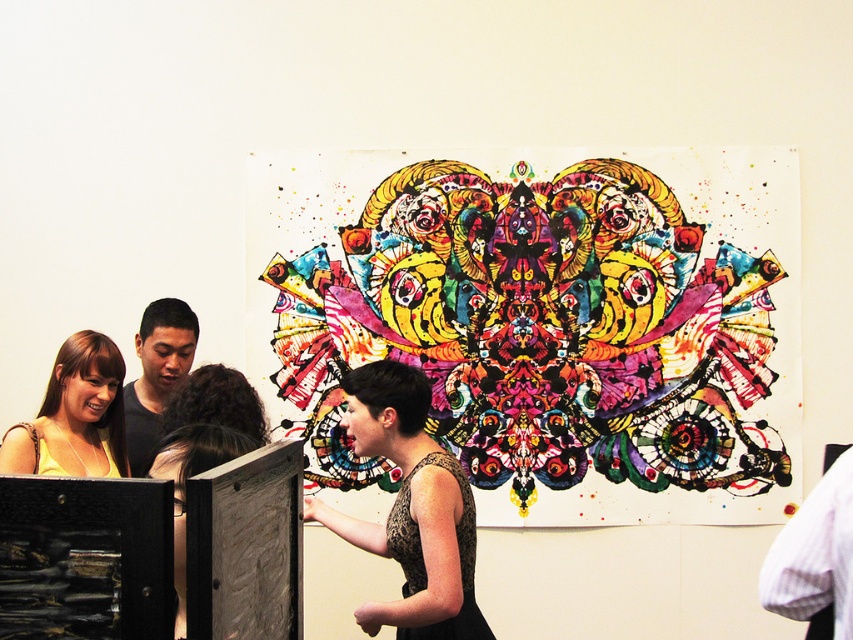
You are an art gallery visitor standing in front of the large abstract painting. You notice two people in the foreground wearing the black textured dress at center and the white striped shirt at right. Which of these two is positioned lower in the image?

The black textured dress at center is positioned lower than the white striped shirt at right in the image.

You are an event planner organizing a photoshoot in this art gallery. You need to position the matte yellow dress at lower left and the white striped shirt at right in a way that they are both visible in the same frame without overlapping. Given their current positions, is this arrangement possible?

Yes, the arrangement is possible because the matte yellow dress at lower left is positioned to the left of the white striped shirt at right, so they can be framed side by side without overlapping.